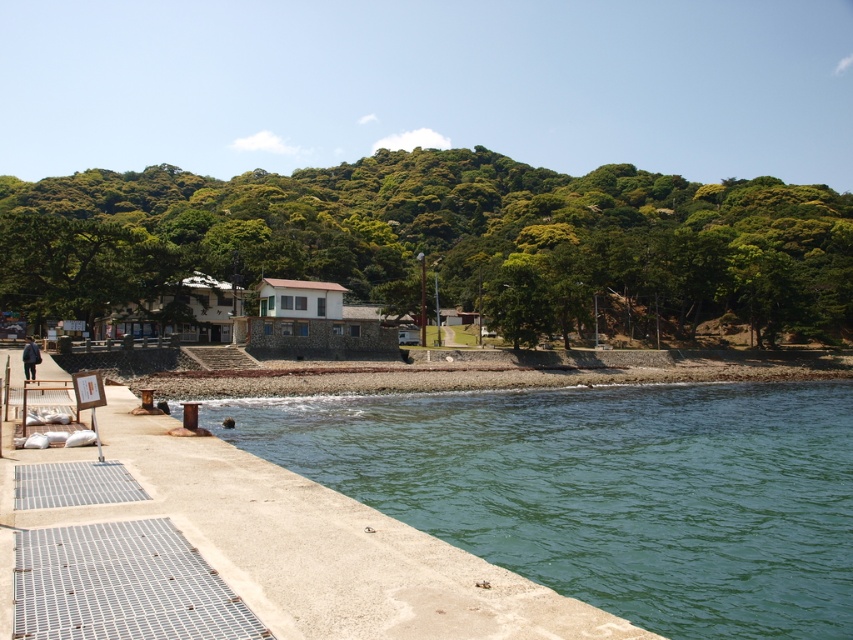
You are standing on the pier and looking towards the buildings. Which object is closer to you, the green leafy hillside at center or the green concrete water at lower left?

The green concrete water at lower left is behind the green leafy hillside at center, so the green leafy hillside at center is closer to you.

You are a hiker who wants to take a photo of the green leafy hillside at center and the green concrete water at lower left. Which object should you focus on first if you want to capture both in one shot without moving the camera?

The green leafy hillside at center is taller than the green concrete water at lower left, so you should focus on the green leafy hillside at center first to ensure it fits within the frame before adjusting for the lower positioned green concrete water at lower left.